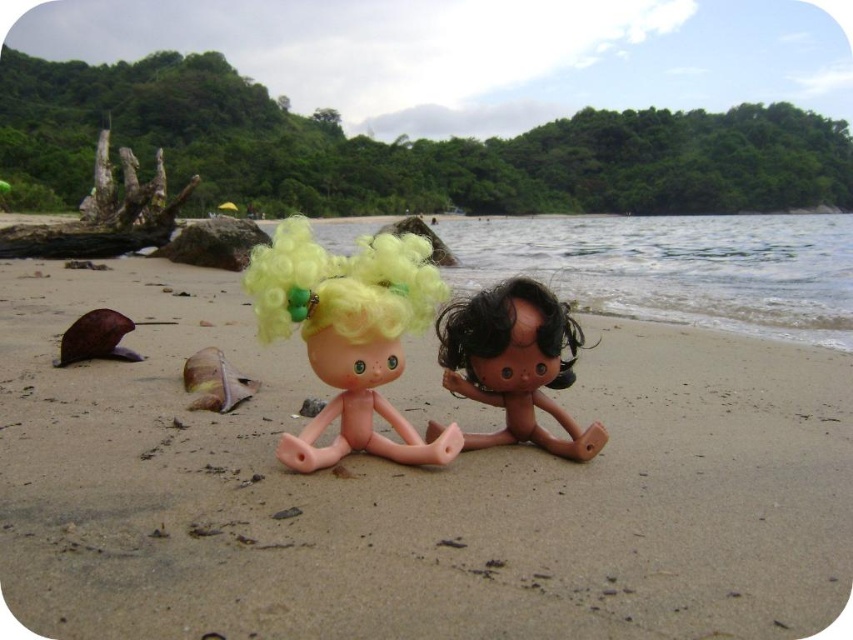
Is smooth beige sand at center below fluffy yellow hair at center?

Yes.

Can you confirm if smooth beige sand at center is positioned to the left of fluffy yellow hair at center?

Yes, smooth beige sand at center is to the left of fluffy yellow hair at center.

Who is more distant from viewer, [294,547] or [361,244]?

The point [361,244] is more distant.

Identify the location of smooth beige sand at center. (410, 490).

Who is more forward, (347, 445) or (582, 339)?

Point (347, 445)

Is pink plastic doll at center positioned at the back of matte plastic doll at center?

No, pink plastic doll at center is in front of matte plastic doll at center.

Locate an element on the screen. The height and width of the screenshot is (640, 853). pink plastic doll at center is located at coordinates (349, 333).

Image resolution: width=853 pixels, height=640 pixels. In order to click on pink plastic doll at center in this screenshot , I will do `click(349, 333)`.

Does matte plastic doll at center appear over fluffy yellow hair at center?

Incorrect, matte plastic doll at center is not positioned above fluffy yellow hair at center.

Is matte plastic doll at center to the right of fluffy yellow hair at center from the viewer's perspective?

Correct, you'll find matte plastic doll at center to the right of fluffy yellow hair at center.

Between point (532, 413) and point (314, 272), which one is positioned behind?

Positioned behind is point (532, 413).

At what (x,y) coordinates should I click in order to perform the action: click on matte plastic doll at center. Please return your answer as a coordinate pair (x, y). Looking at the image, I should click on (514, 364).